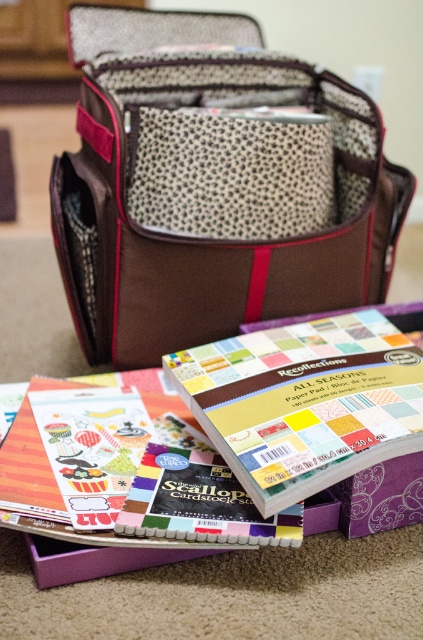
Question: Does matte paper pad at lower center have a smaller size compared to purple cardboard box at lower center?

Choices:
 (A) no
 (B) yes

Answer: (B)

Question: Is the position of brown fabric bag at center less distant than that of matte paper pad at lower center?

Choices:
 (A) no
 (B) yes

Answer: (A)

Question: Among these objects, which one is farthest from the camera?

Choices:
 (A) brown fabric bag at center
 (B) purple cardboard box at lower center

Answer: (A)

Question: Considering the real-world distances, which object is closest to the matte paper pad at lower center?

Choices:
 (A) brown fabric bag at center
 (B) purple cardboard box at lower center

Answer: (B)

Question: Which object appears closest to the camera in this image?

Choices:
 (A) purple cardboard box at lower center
 (B) matte paper pad at lower center
 (C) brown fabric bag at center

Answer: (B)

Question: Can you confirm if brown fabric bag at center is positioned below matte paper pad at lower center?

Choices:
 (A) yes
 (B) no

Answer: (B)